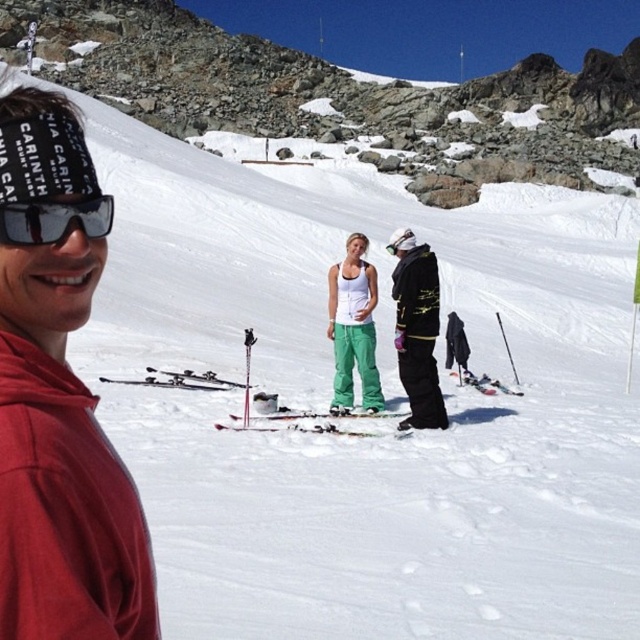
Which is more to the right, red fabric headband at upper left or green plastic ski at center?

Positioned to the right is green plastic ski at center.

Between point (106, 220) and point (388, 417), which one is positioned behind?

Point (388, 417)

Is point (26, 211) farther from viewer compared to point (376, 435)?

No, (26, 211) is closer to viewer.

Where is `red fabric headband at upper left`? red fabric headband at upper left is located at coordinates (58, 397).

Between point (138, 545) and point (49, 243), which one is positioned in front?

Point (138, 545) is in front.

Looking at this image, between red fabric headband at upper left and black matte sunglasses at left, which one appears on the left side from the viewer's perspective?

Positioned to the left is red fabric headband at upper left.

The width and height of the screenshot is (640, 640). In order to click on red fabric headband at upper left in this screenshot , I will do `click(58, 397)`.

Does point (12, 241) come farther from viewer compared to point (230, 428)?

No, (12, 241) is in front of (230, 428).

Between point (19, 220) and point (304, 416), which one is positioned behind?

Point (304, 416)

Find the location of a particular element. Image resolution: width=640 pixels, height=640 pixels. black matte sunglasses at left is located at coordinates (52, 220).